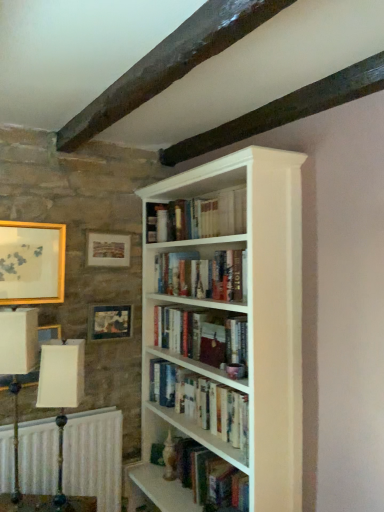
Question: Is wooden picture frame at left, the 3th picture frame when ordered from right to left, not close to hardcover books at center, which is the 1th book in bottom-to-top order?

Choices:
 (A) no
 (B) yes

Answer: (A)

Question: From the image's perspective, is wooden picture frame at left, the first picture frame in the left-to-right sequence, below hardcover books at center, which is the 1th book in bottom-to-top order?

Choices:
 (A) yes
 (B) no

Answer: (B)

Question: Is wooden picture frame at left, the 3th picture frame when ordered from right to left, oriented towards hardcover books at center, which is the 1th book in bottom-to-top order?

Choices:
 (A) no
 (B) yes

Answer: (A)

Question: Considering the relative sizes of wooden picture frame at left, the 3th picture frame when ordered from right to left, and hardcover books at center, which is the 1th book in bottom-to-top order, in the image provided, is wooden picture frame at left, the 3th picture frame when ordered from right to left, taller than hardcover books at center, which is the 1th book in bottom-to-top order,?

Choices:
 (A) no
 (B) yes

Answer: (B)

Question: Is the depth of wooden picture frame at left, the first picture frame in the left-to-right sequence, less than that of hardcover books at center, which is the 1th book in bottom-to-top order?

Choices:
 (A) no
 (B) yes

Answer: (A)

Question: Is wooden picture frame at left, the first picture frame in the left-to-right sequence, facing away from hardcover books at center, marked as the fourth book in a top-to-bottom arrangement?

Choices:
 (A) no
 (B) yes

Answer: (A)

Question: Considering the relative sizes of wooden picture frame at left, the first picture frame in the left-to-right sequence, and hardcover book at center, which is the third book from top to bottom, in the image provided, is wooden picture frame at left, the first picture frame in the left-to-right sequence, taller than hardcover book at center, which is the third book from top to bottom,?

Choices:
 (A) no
 (B) yes

Answer: (B)

Question: Does wooden picture frame at left, the first picture frame in the left-to-right sequence, have a lesser height compared to hardcover book at center, the 2th book positioned from the bottom?

Choices:
 (A) yes
 (B) no

Answer: (B)

Question: Can you confirm if wooden picture frame at left, the first picture frame in the left-to-right sequence, is positioned to the left of hardcover book at center, which is the third book from top to bottom?

Choices:
 (A) no
 (B) yes

Answer: (B)

Question: Considering the relative sizes of wooden picture frame at left, the 3th picture frame when ordered from right to left, and hardcover book at center, which is the third book from top to bottom, in the image provided, is wooden picture frame at left, the 3th picture frame when ordered from right to left, smaller than hardcover book at center, which is the third book from top to bottom,?

Choices:
 (A) yes
 (B) no

Answer: (A)

Question: Considering the relative sizes of wooden picture frame at left, the 3th picture frame when ordered from right to left, and hardcover book at center, which is the third book from top to bottom, in the image provided, is wooden picture frame at left, the 3th picture frame when ordered from right to left, thinner than hardcover book at center, which is the third book from top to bottom,?

Choices:
 (A) no
 (B) yes

Answer: (B)

Question: Does wooden picture frame at left, the first picture frame in the left-to-right sequence, lie behind hardcover book at center, the 2th book positioned from the bottom?

Choices:
 (A) yes
 (B) no

Answer: (A)

Question: Can you confirm if white painted wood bookcase at center is positioned to the left of matte gold picture frame at upper left, positioned as the second picture frame in right-to-left order?

Choices:
 (A) yes
 (B) no

Answer: (B)